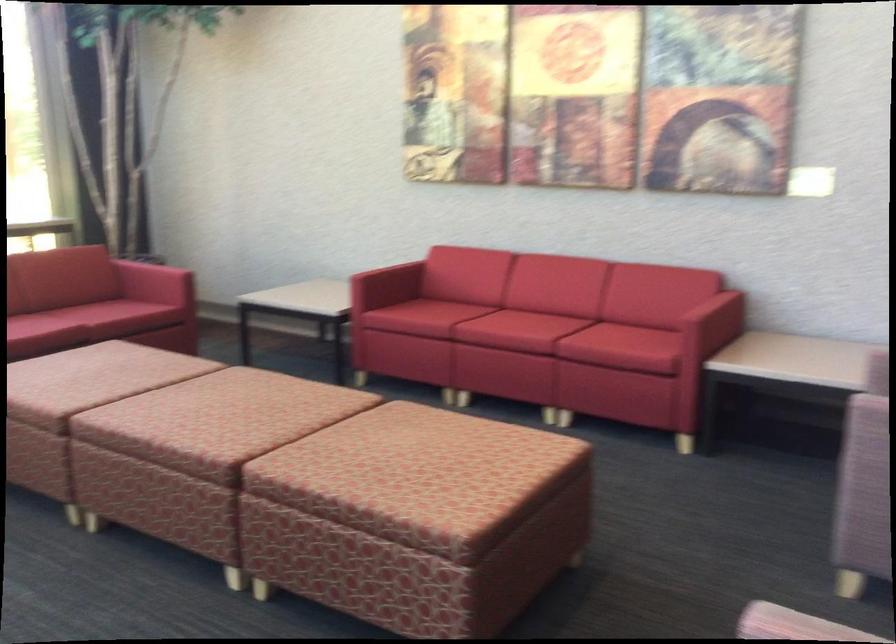
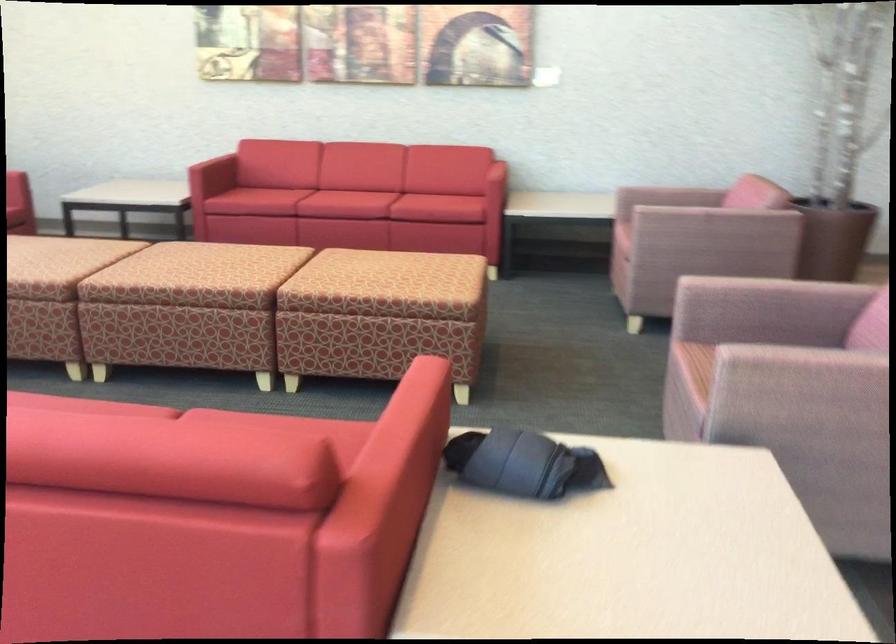
Find the pixel in the second image that matches (x=407, y=466) in the first image.

(385, 270)